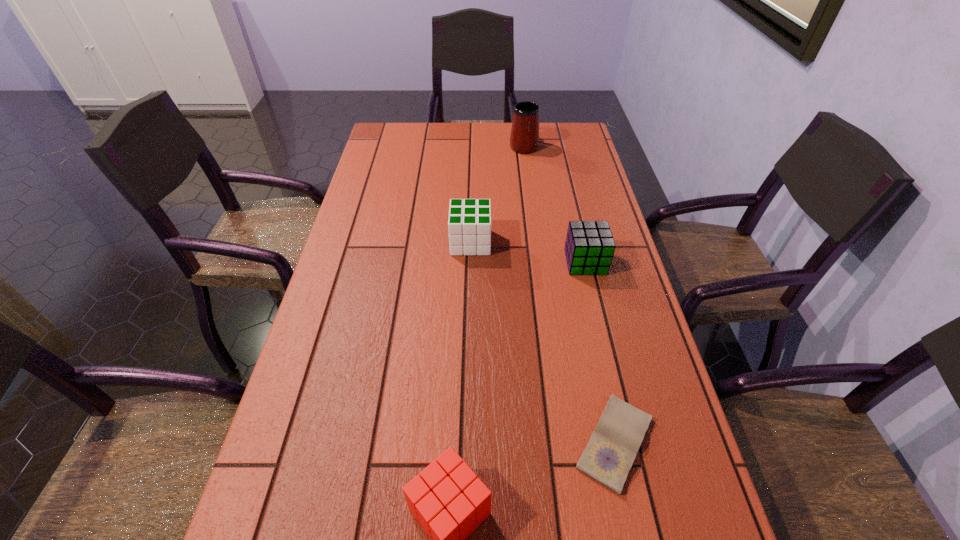
Identify the location of object identified as the closest to the nearest cube. This screenshot has height=540, width=960. (608, 457).

Where is `cube that is the closest to the nearest cube`? cube that is the closest to the nearest cube is located at coordinates (589, 248).

Locate which cube is the second closest to the nearest cube. Please provide its 2D coordinates. Your answer should be formatted as a tuple, i.e. [(x, y)], where the tuple contains the x and y coordinates of a point satisfying the conditions above.

[(469, 224)]